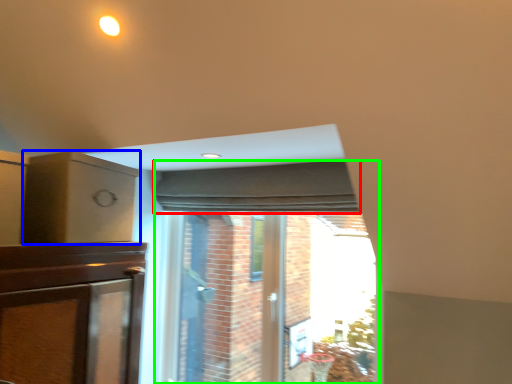
Question: Based on their relative distances, which object is nearer to curtain (highlighted by a red box)? Choose from cabinetry (highlighted by a blue box) and bay window (highlighted by a green box).

Choices:
 (A) cabinetry
 (B) bay window

Answer: (B)